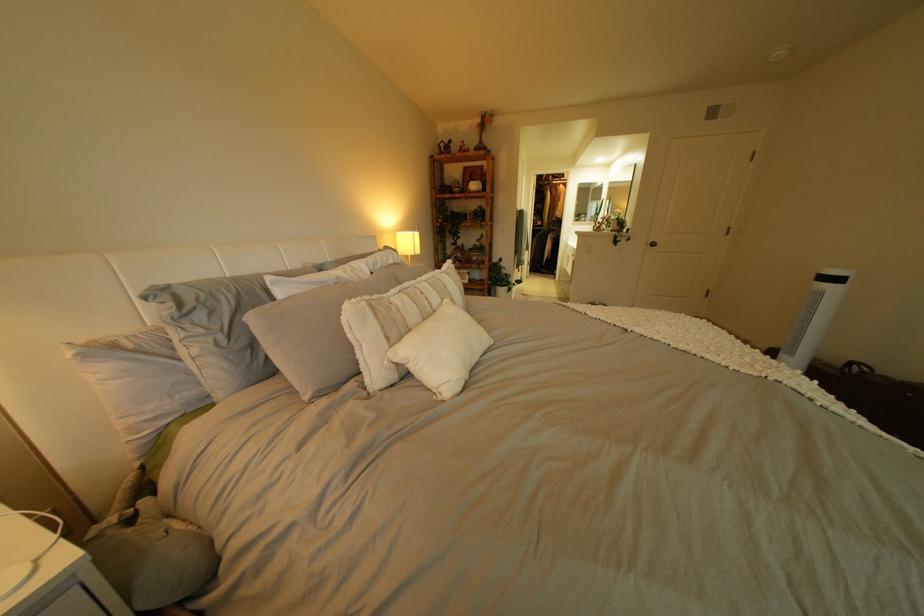
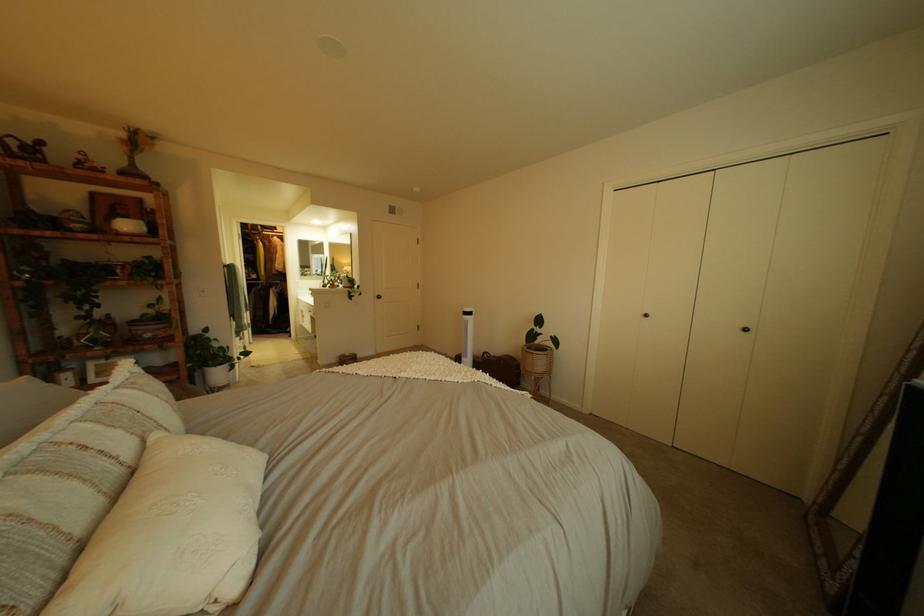
In the second image, find the point that corresponds to (x=494, y=122) in the first image.

(139, 137)